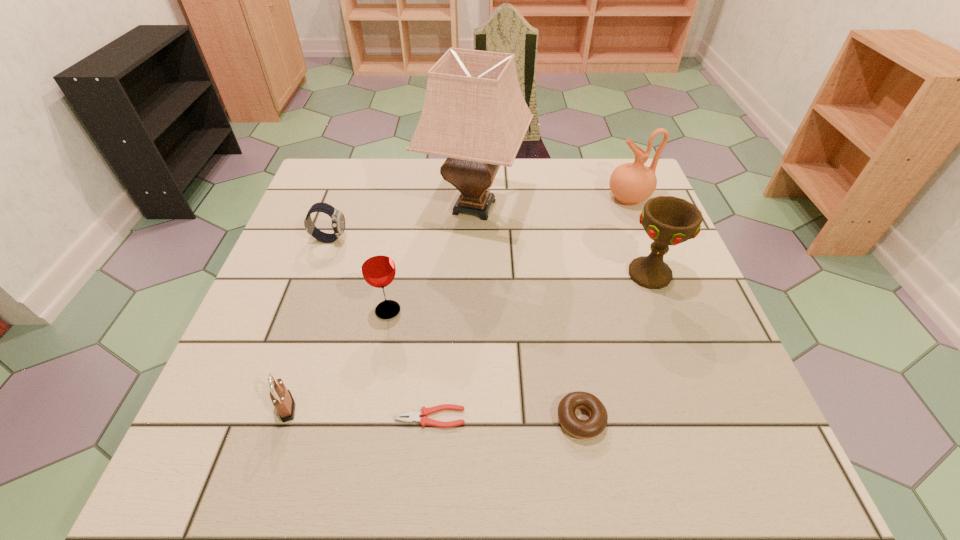
You are a GUI agent. You are given a task and a screenshot of the screen. Output one action in this format:
    pyautogui.click(x=<x>, y=<y>)
    Task: Click on the pottery located in the far edge section of the desktop
    Image resolution: width=960 pixels, height=540 pixels.
    Given the screenshot: What is the action you would take?
    pyautogui.click(x=631, y=183)

This screenshot has height=540, width=960. Find the location of `object at the near edge`. object at the near edge is located at coordinates pyautogui.click(x=583, y=429).

I want to click on watch situated at the left edge, so click(338, 220).

I want to click on padlock situated at the left edge, so click(x=282, y=399).

At what (x,y) coordinates should I click in order to perform the action: click on pottery at the right edge. Please return your answer as a coordinate pair (x, y). Looking at the image, I should click on (631, 183).

Image resolution: width=960 pixels, height=540 pixels. What are the coordinates of `chalice that is at the right edge` in the screenshot? It's located at (668, 220).

Locate an element on the screen. This screenshot has height=540, width=960. object located at the far right corner is located at coordinates (631, 183).

This screenshot has width=960, height=540. What are the coordinates of `vacant region at the far edge of the desktop` in the screenshot? It's located at coord(531,178).

Locate an element on the screen. free region at the near edge of the desktop is located at coordinates (489, 478).

In the image, there is a desktop. At what (x,y) coordinates should I click in order to perform the action: click on free region at the left edge. Please return your answer as a coordinate pair (x, y). Image resolution: width=960 pixels, height=540 pixels. Looking at the image, I should click on coord(284,345).